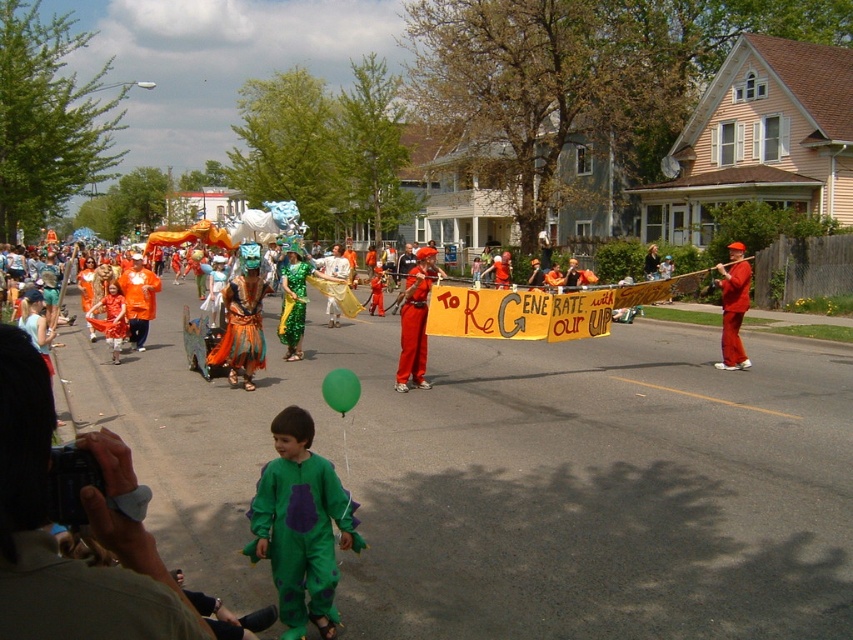
Does point (231, 288) lie behind point (405, 321)?

No, (231, 288) is closer to viewer.

Is shiny metallic armor at center above shiny red pants at center?

No, shiny metallic armor at center is not above shiny red pants at center.

Based on the photo, who is more distant from viewer, (248, 272) or (421, 369)?

Point (421, 369)

The image size is (853, 640). I want to click on shiny metallic armor at center, so click(241, 326).

Does green shiny dragon at center come behind green rubber balloon at center?

Yes, it is behind green rubber balloon at center.

Is point (310, 275) closer to viewer compared to point (350, 385)?

No, (310, 275) is further to viewer.

You are a GUI agent. You are given a task and a screenshot of the screen. Output one action in this format:
    pyautogui.click(x=<x>, y=<y>)
    Task: Click on the green shiny dragon at center
    The height and width of the screenshot is (640, 853).
    Given the screenshot: What is the action you would take?
    pyautogui.click(x=293, y=304)

Where is `green shiny dragon at center`? The image size is (853, 640). green shiny dragon at center is located at coordinates (293, 304).

Is point (309, 598) closer to viewer compared to point (285, 282)?

Yes, point (309, 598) is in front of point (285, 282).

Does green matte jumpsuit at lower center appear over green shiny dragon at center?

Actually, green matte jumpsuit at lower center is below green shiny dragon at center.

Where is `green matte jumpsuit at lower center`? green matte jumpsuit at lower center is located at coordinates (300, 525).

Identify the location of green matte jumpsuit at lower center. (300, 525).